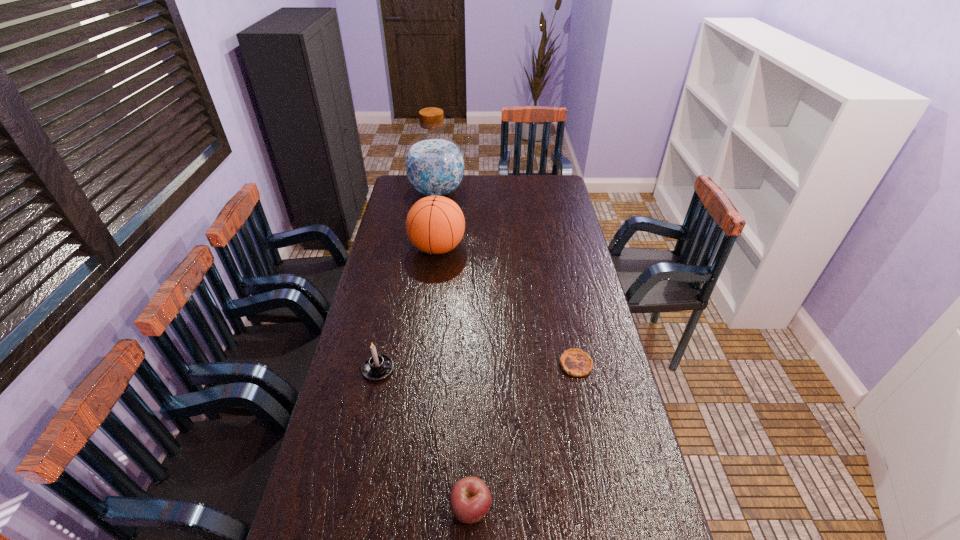
This screenshot has width=960, height=540. In order to click on the farthest object in this screenshot , I will do `click(434, 165)`.

The height and width of the screenshot is (540, 960). In order to click on the tallest object in this screenshot , I will do `click(434, 165)`.

I want to click on basketball, so click(435, 224).

You are a GUI agent. You are given a task and a screenshot of the screen. Output one action in this format:
    pyautogui.click(x=<x>, y=<y>)
    Task: Click on the fourth nearest object
    The width and height of the screenshot is (960, 540).
    Given the screenshot: What is the action you would take?
    pyautogui.click(x=435, y=224)

Locate an element on the screen. Image resolution: width=960 pixels, height=540 pixels. the third shortest object is located at coordinates 377,367.

Locate an element on the screen. the fourth tallest object is located at coordinates (470, 500).

Where is `the nearest object`? the nearest object is located at coordinates (470, 500).

The width and height of the screenshot is (960, 540). Find the location of `the rightmost object`. the rightmost object is located at coordinates (575, 362).

The width and height of the screenshot is (960, 540). Find the location of `quiche`. quiche is located at coordinates (575, 362).

In order to click on vacant position located 0.230m on the front of the tallest object in this screenshot , I will do `click(430, 235)`.